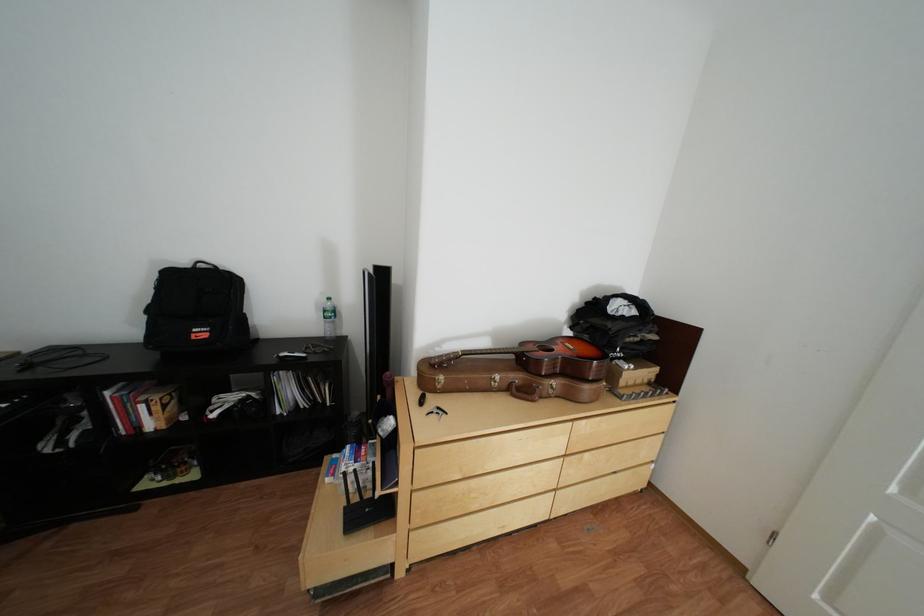
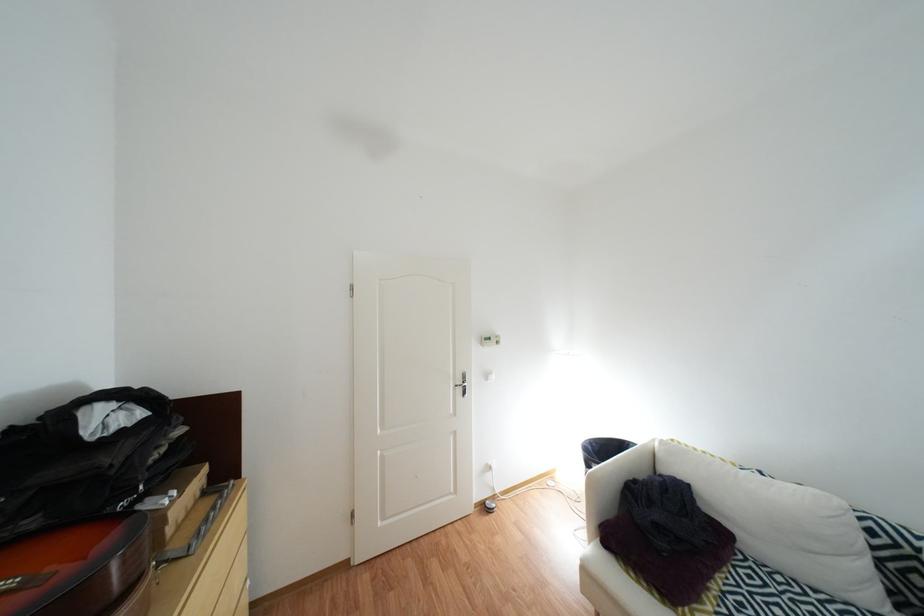
Locate, in the second image, the point that corresponds to (588,347) in the first image.

(27, 584)